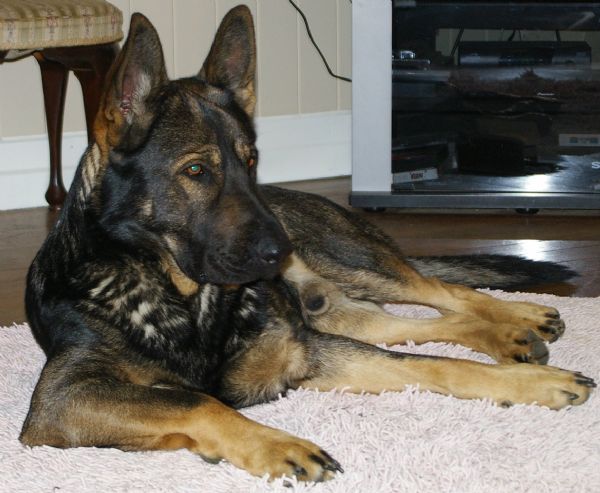
You are a GUI agent. You are given a task and a screenshot of the screen. Output one action in this format:
    pyautogui.click(x=<x>, y=<y>)
    Task: Click on the finished wood floors
    
    Given the screenshot: What is the action you would take?
    tap(25, 244)